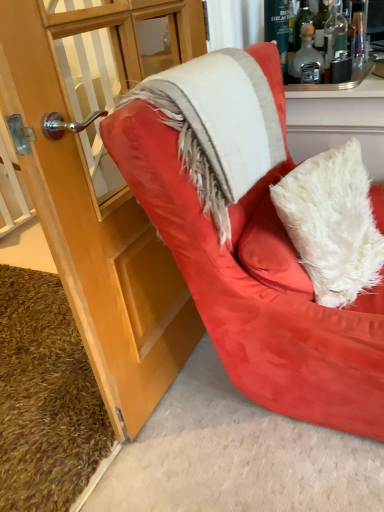
Question: Is brown shaggy carpet at lower left smaller than translucent glass bottle at upper right, the 1th bottle when ordered from right to left?

Choices:
 (A) no
 (B) yes

Answer: (A)

Question: Is brown shaggy carpet at lower left oriented towards translucent glass bottle at upper right, the 1th bottle when ordered from right to left?

Choices:
 (A) yes
 (B) no

Answer: (B)

Question: Is brown shaggy carpet at lower left wider than translucent glass bottle at upper right, the 1th bottle when ordered from right to left?

Choices:
 (A) yes
 (B) no

Answer: (A)

Question: From the image's perspective, is brown shaggy carpet at lower left beneath translucent glass bottle at upper right, which is the 2th bottle in left-to-right order?

Choices:
 (A) no
 (B) yes

Answer: (B)

Question: Is brown shaggy carpet at lower left shorter than translucent glass bottle at upper right, which is the 2th bottle in left-to-right order?

Choices:
 (A) no
 (B) yes

Answer: (B)

Question: Is brown shaggy carpet at lower left further to the viewer compared to translucent glass bottle at upper right, which is the 2th bottle in left-to-right order?

Choices:
 (A) yes
 (B) no

Answer: (B)

Question: Considering the relative sizes of translucent glass bottle at upper right, which is the 2th bottle in left-to-right order, and white fluffy pillow at center in the image provided, is translucent glass bottle at upper right, which is the 2th bottle in left-to-right order, taller than white fluffy pillow at center?

Choices:
 (A) no
 (B) yes

Answer: (A)

Question: Does translucent glass bottle at upper right, which is the 2th bottle in left-to-right order, have a smaller size compared to white fluffy pillow at center?

Choices:
 (A) no
 (B) yes

Answer: (B)

Question: From a real-world perspective, is translucent glass bottle at upper right, which is the 2th bottle in left-to-right order, on top of white fluffy pillow at center?

Choices:
 (A) yes
 (B) no

Answer: (A)

Question: Is the depth of translucent glass bottle at upper right, the 1th bottle when ordered from right to left, greater than that of white fluffy pillow at center?

Choices:
 (A) yes
 (B) no

Answer: (A)

Question: From the image's perspective, does translucent glass bottle at upper right, the 1th bottle when ordered from right to left, appear lower than white fluffy pillow at center?

Choices:
 (A) yes
 (B) no

Answer: (B)

Question: Can you confirm if translucent glass bottle at upper right, which is the 2th bottle in left-to-right order, is shorter than white fluffy pillow at center?

Choices:
 (A) no
 (B) yes

Answer: (B)

Question: From a real-world perspective, is white fuzzy blanket at upper right on brown shaggy carpet at lower left?

Choices:
 (A) no
 (B) yes

Answer: (B)